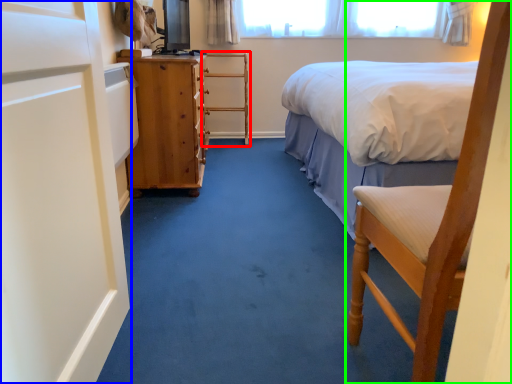
Question: Estimate the real-world distances between objects in this image. Which object is farther from armchair (highlighted by a red box), screen door (highlighted by a blue box) or chair (highlighted by a green box)?

Choices:
 (A) screen door
 (B) chair

Answer: (B)